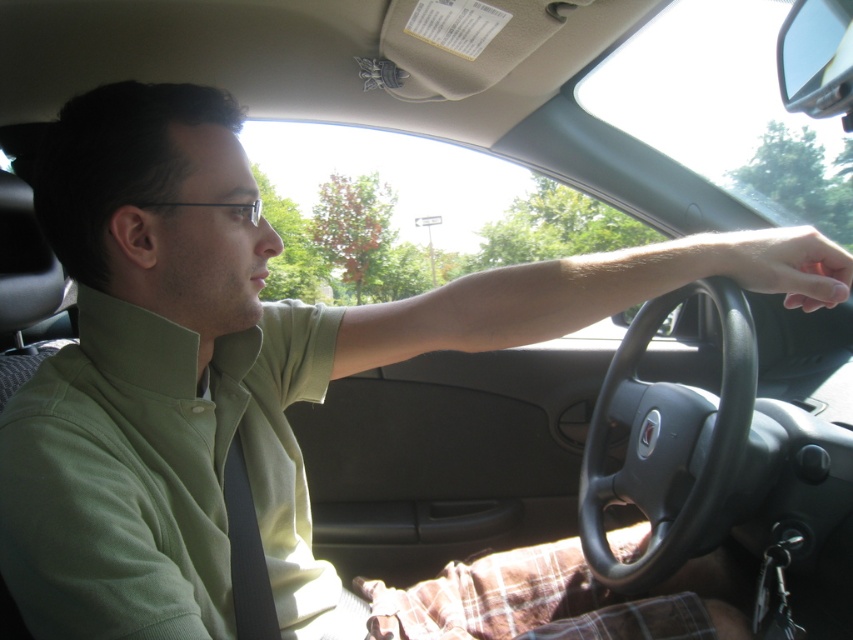
Which is behind, point (610, 492) or point (762, 273)?

Positioned behind is point (610, 492).

Does black leather steering wheel at center appear on the right side of dry matte skin at steering wheel?

In fact, black leather steering wheel at center is to the left of dry matte skin at steering wheel.

The height and width of the screenshot is (640, 853). What do you see at coordinates (668, 458) in the screenshot?
I see `black leather steering wheel at center` at bounding box center [668, 458].

The image size is (853, 640). I want to click on black leather steering wheel at center, so click(x=668, y=458).

Which is above, green fabric shirt at center or dry matte skin at steering wheel?

dry matte skin at steering wheel

Which is in front, point (308, 365) or point (786, 285)?

Point (786, 285) is in front.

I want to click on green fabric shirt at center, so click(x=160, y=474).

Is point (15, 580) more distant than point (605, 477)?

No, (15, 580) is in front of (605, 477).

Does point (291, 496) come closer to viewer compared to point (749, 392)?

No, (291, 496) is behind (749, 392).

Image resolution: width=853 pixels, height=640 pixels. Identify the location of green fabric shirt at center. (160, 474).